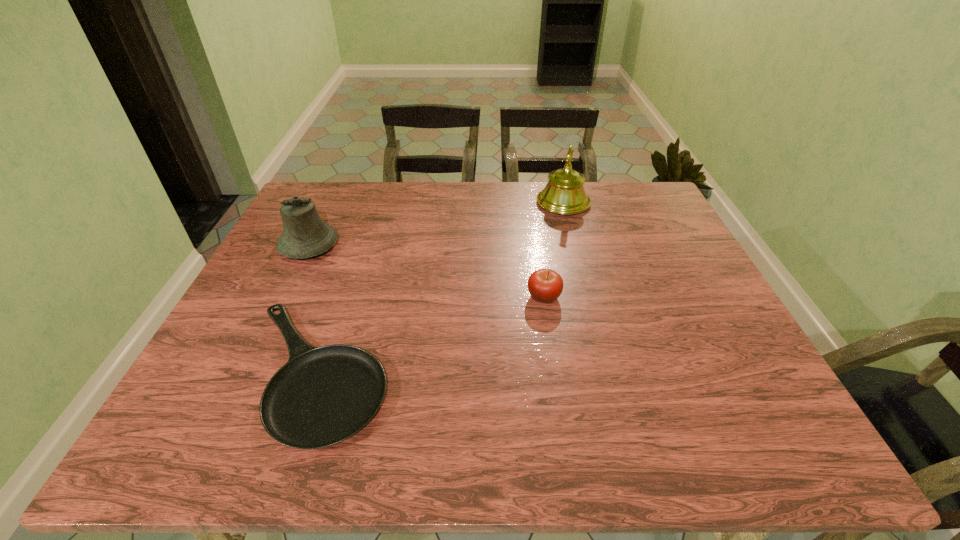
Find the location of a particular element. Image resolution: width=960 pixels, height=540 pixels. the tallest object is located at coordinates (564, 194).

Locate an element on the screen. the taller bell is located at coordinates [564, 194].

This screenshot has height=540, width=960. Find the location of `the shorter bell`. the shorter bell is located at coordinates pyautogui.click(x=305, y=235).

I want to click on the second farthest object, so click(x=305, y=235).

The image size is (960, 540). In order to click on the third farthest object in this screenshot , I will do `click(545, 285)`.

Find the location of a particular element. This screenshot has height=540, width=960. apple is located at coordinates (545, 285).

At what (x,y) coordinates should I click in order to perform the action: click on frying pan. Please return your answer as a coordinate pair (x, y). The image size is (960, 540). Looking at the image, I should click on (322, 396).

This screenshot has width=960, height=540. Identify the location of the nearest object. (322, 396).

The height and width of the screenshot is (540, 960). In order to click on vacant space located on the left of the right bell in this screenshot , I will do `click(496, 202)`.

In order to click on free point located on the back of the second tallest object in this screenshot , I will do `click(338, 186)`.